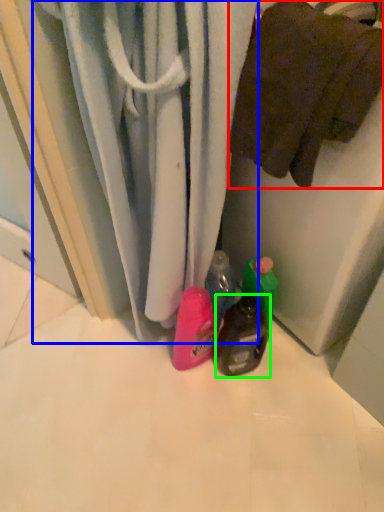
Question: Which is farther away from towel (highlighted by a red box)? curtain (highlighted by a blue box) or bottle (highlighted by a green box)?

Choices:
 (A) curtain
 (B) bottle

Answer: (B)